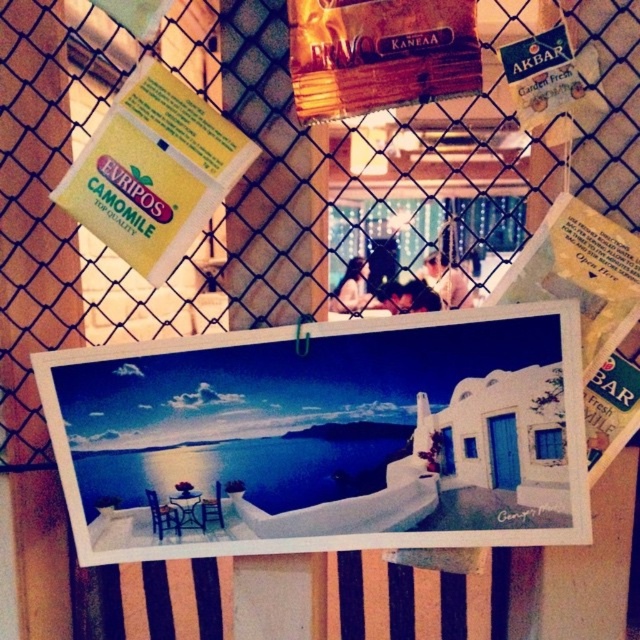
Question: Is white matte postcard at center wider than yellow paper at upper left?

Choices:
 (A) yes
 (B) no

Answer: (A)

Question: Among these points, which one is farthest from the camera?

Choices:
 (A) (172, 244)
 (B) (442, 440)

Answer: (B)

Question: Can you confirm if white matte postcard at center is thinner than yellow paper at upper left?

Choices:
 (A) yes
 (B) no

Answer: (B)

Question: Is white matte postcard at center smaller than yellow paper at upper left?

Choices:
 (A) yes
 (B) no

Answer: (B)

Question: Which point is closer to the camera?

Choices:
 (A) white matte postcard at center
 (B) yellow paper at upper left

Answer: (B)